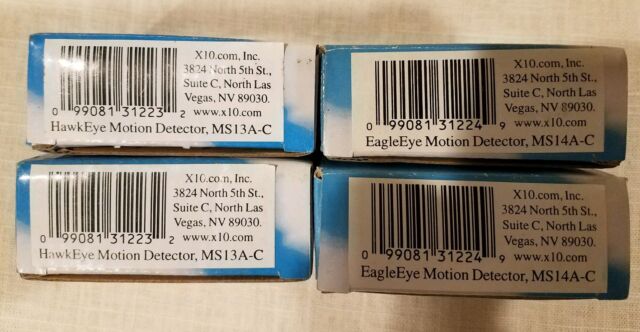
Find the location of `"hawkeye motion detector"`. "hawkeye motion detector" is located at coordinates (120, 132), (118, 265).